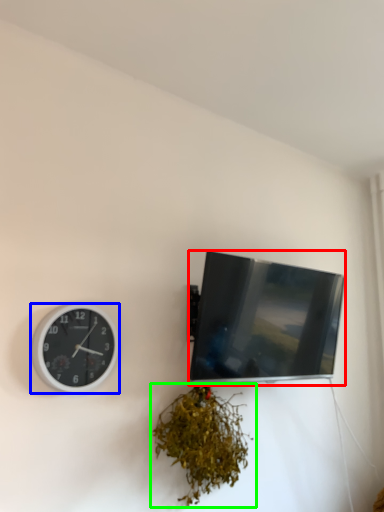
Question: Which object is the farthest from television (highlighted by a red box)? Choose among these: wall clock (highlighted by a blue box) or houseplant (highlighted by a green box).

Choices:
 (A) wall clock
 (B) houseplant

Answer: (A)